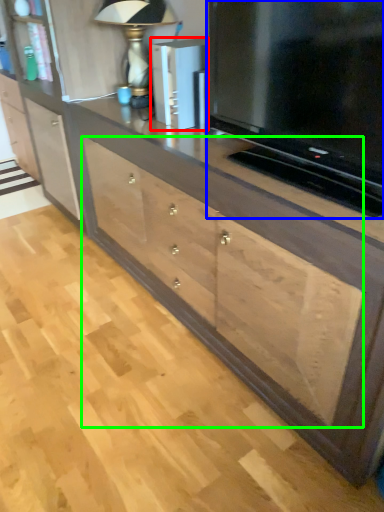
Question: Estimate the real-world distances between objects in this image. Which object is closer to appliance (highlighted by a red box), television (highlighted by a blue box) or drawer (highlighted by a green box)?

Choices:
 (A) television
 (B) drawer

Answer: (A)